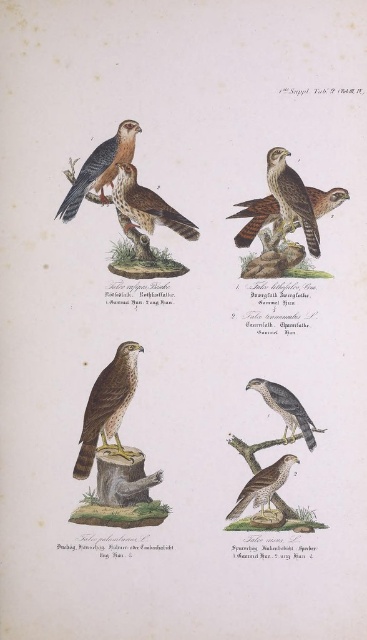
Question: Which point is closer to the camera?

Choices:
 (A) brown speckled falcon at center
 (B) brown speckled feathers at center

Answer: (A)

Question: Is brown speckled feathers at center bigger than brown feathered eagle at upper right?

Choices:
 (A) yes
 (B) no

Answer: (A)

Question: In this image, where is brown speckled feathers at upper left located relative to brown speckled feathers at center?

Choices:
 (A) below
 (B) above

Answer: (B)

Question: Among these points, which one is nearest to the camera?

Choices:
 (A) (63, 209)
 (B) (161, 214)
 (C) (108, 392)

Answer: (A)

Question: Does brown feathered eagle at upper right lie in front of brown feathered eagle at center?

Choices:
 (A) no
 (B) yes

Answer: (B)

Question: Which of these objects is positioned farthest from the brown feathered eagle at center?

Choices:
 (A) rufous-brown feathered falcon at center
 (B) brown speckled feathers at upper left
 (C) brown feathered eagle at upper right
 (D) brown speckled feathers at center

Answer: (B)